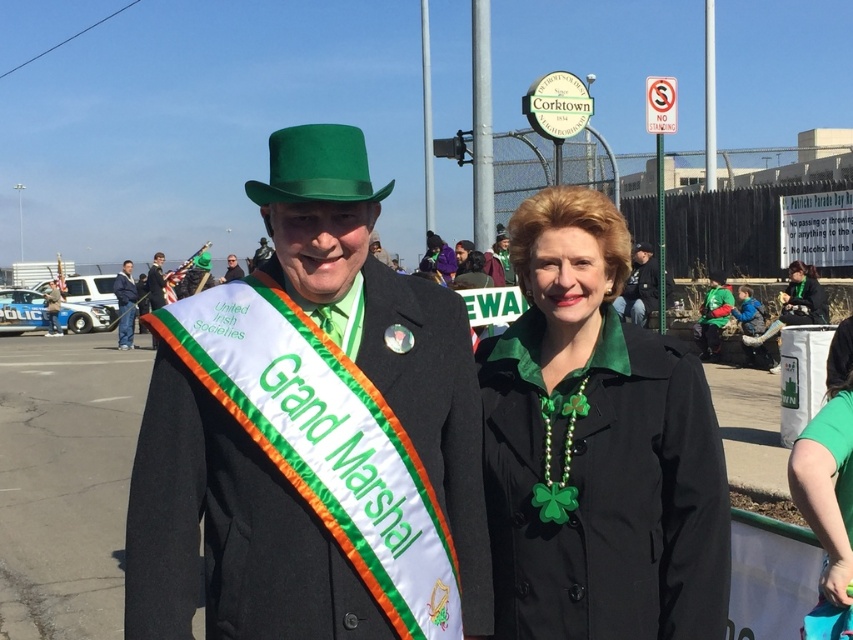
Which of these two, black leather jacket at center or matte black hat at center, stands taller?

matte black hat at center is taller.

Between point (628, 296) and point (231, 268), which one is positioned in front?

Point (628, 296)

You are a GUI agent. You are given a task and a screenshot of the screen. Output one action in this format:
    pyautogui.click(x=<x>, y=<y>)
    Task: Click on the black leather jacket at center
    
    Given the screenshot: What is the action you would take?
    pyautogui.click(x=641, y=285)

How much distance is there between black leather jacket at center and green felt hat at center?

black leather jacket at center and green felt hat at center are 19.39 inches apart from each other.

Who is more distant from viewer, (650, 308) or (641, 248)?

Positioned behind is point (641, 248).

Is point (653, 300) less distant than point (648, 252)?

Yes, point (653, 300) is in front of point (648, 252).

Image resolution: width=853 pixels, height=640 pixels. In order to click on black leather jacket at center in this screenshot , I will do `click(641, 285)`.

Is black leather jacket at center smaller than blue denim jacket at left?

Actually, black leather jacket at center might be larger than blue denim jacket at left.

In the scene shown: How far apart are black leather jacket at center and blue denim jacket at left?

They are 39.75 feet apart.

Is point (653, 266) positioned after point (132, 317)?

No, it is in front of (132, 317).

I want to click on black leather jacket at center, so click(641, 285).